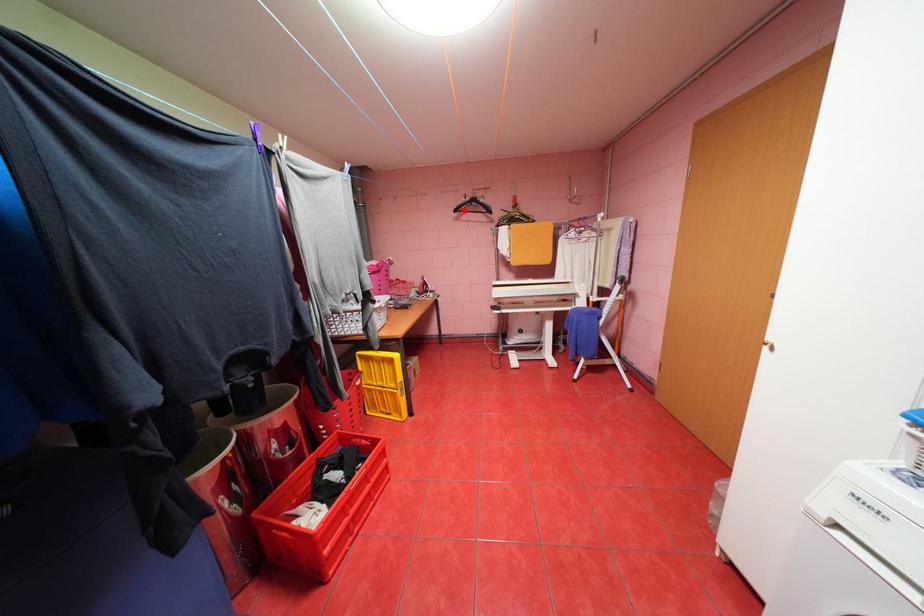
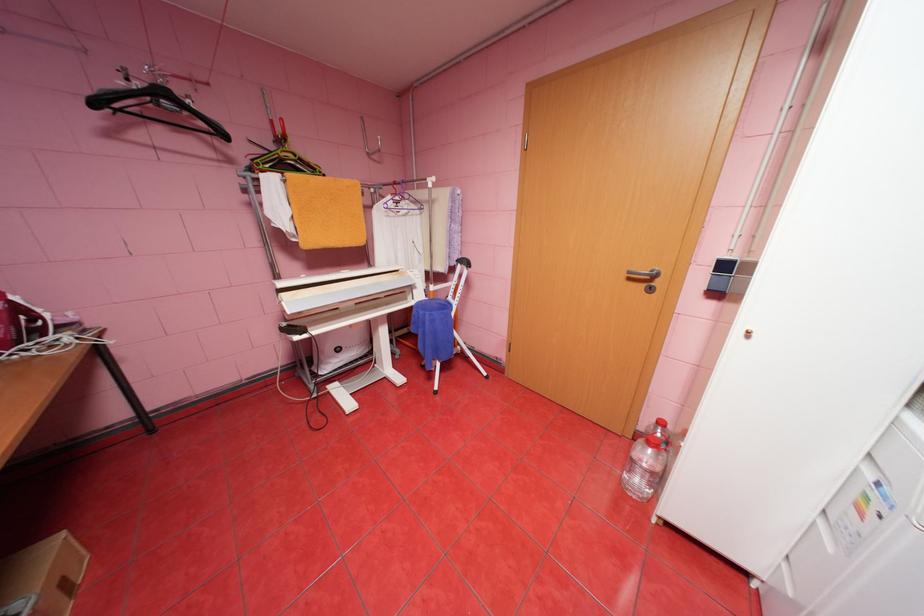
In the second image, find the point that corresponds to the highlighted location in the first image.

(103, 103)